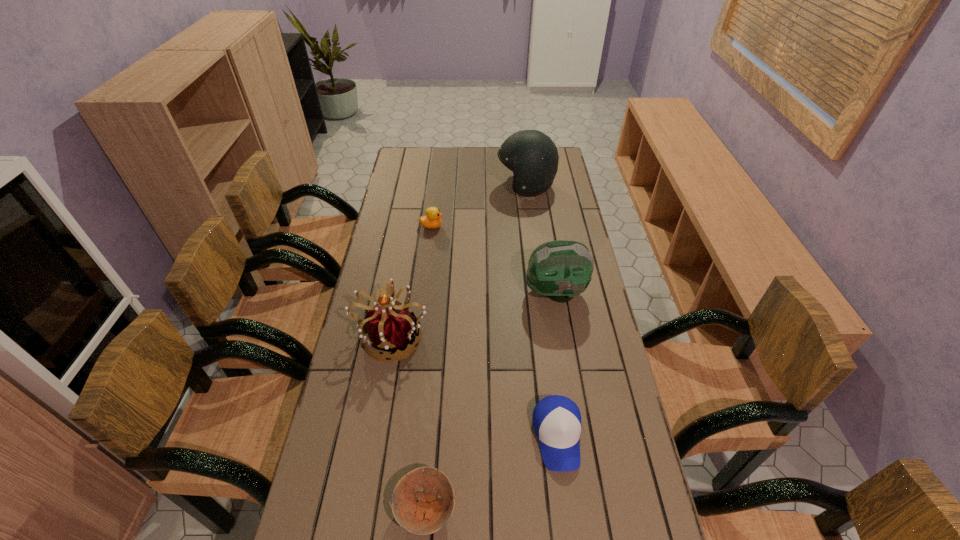
At what (x,y) coordinates should I click in order to perform the action: click on vacant space located on the visor of the nearer football helmet. Please return your answer as a coordinate pair (x, y). The height and width of the screenshot is (540, 960). Looking at the image, I should click on click(409, 292).

Identify the location of vacant space situated 0.160m on the visor of the nearer football helmet. (477, 292).

At what (x,y) coordinates should I click in order to perform the action: click on vacant space located on the visor of the nearer football helmet. Please return your answer as a coordinate pair (x, y). The image size is (960, 540). Looking at the image, I should click on (507, 292).

At what (x,y) coordinates should I click in order to perform the action: click on vacant space located 0.390m on the face of the duckling. Please return your answer as a coordinate pair (x, y). This screenshot has width=960, height=540. Looking at the image, I should click on (541, 226).

Find the location of a particular element. The width and height of the screenshot is (960, 540). free space located 0.090m on the front-facing side of the fifth farthest object is located at coordinates (567, 516).

The image size is (960, 540). I want to click on object located in the far edge section of the desktop, so click(x=532, y=156).

Locate an element on the screen. tiara at the left edge is located at coordinates (391, 329).

You are a GUI agent. You are given a task and a screenshot of the screen. Output one action in this format:
    pyautogui.click(x=<x>, y=<y>)
    Task: Click on the duckling that is at the left edge
    This screenshot has height=540, width=960.
    Given the screenshot: What is the action you would take?
    pyautogui.click(x=432, y=219)

This screenshot has width=960, height=540. I want to click on baseball cap that is at the right edge, so click(x=556, y=419).

Where is `object positioned at the far right corner`? object positioned at the far right corner is located at coordinates (532, 156).